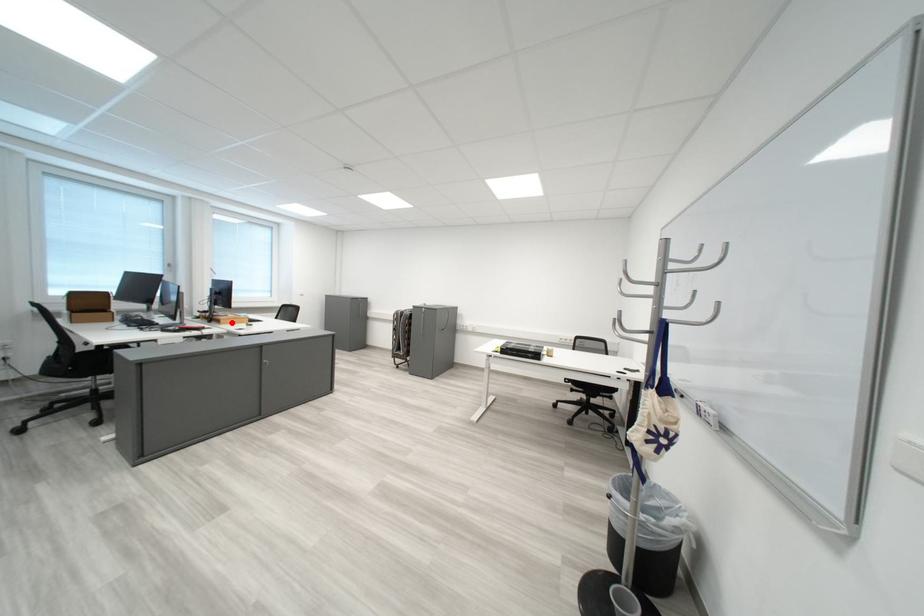
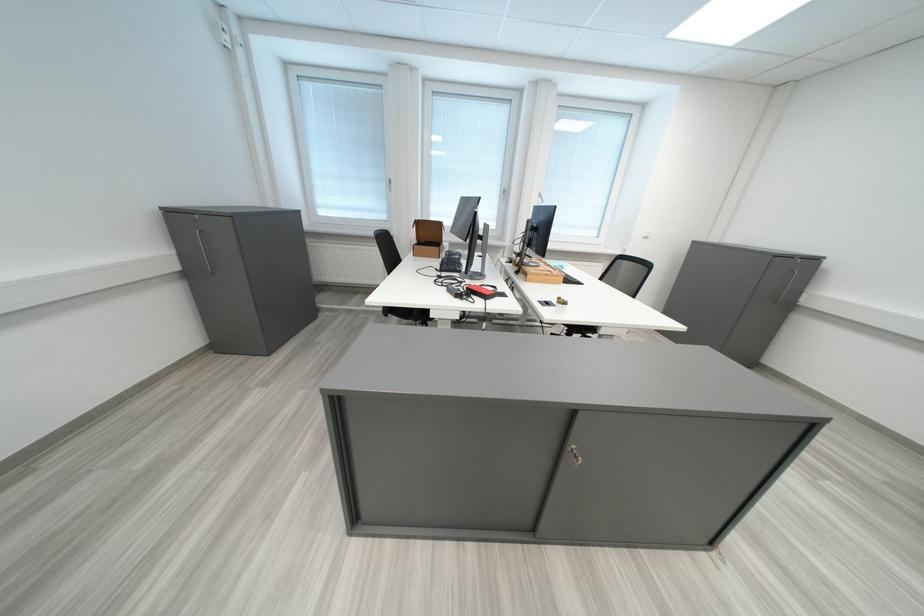
Find the pixel in the second image that matches the highlighted location in the first image.

(539, 276)